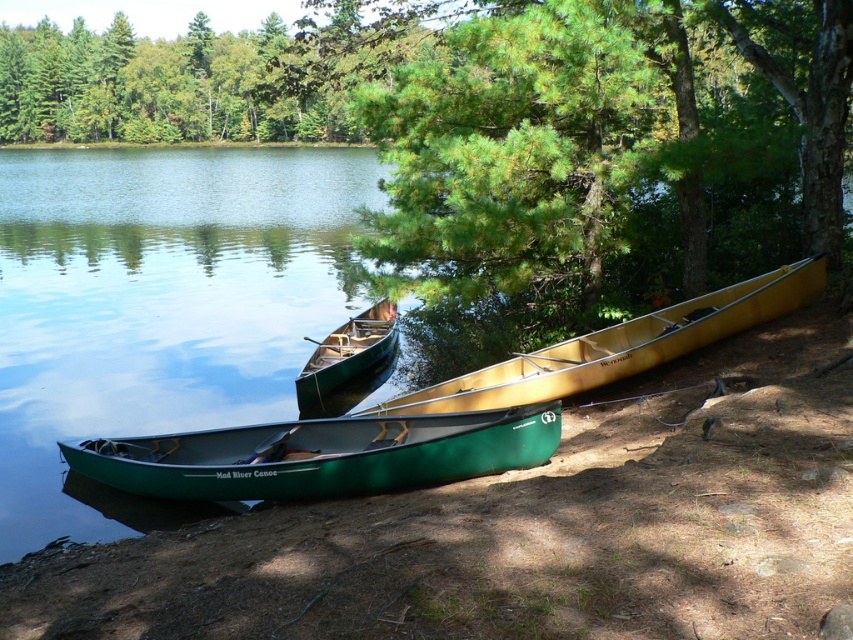
You are planning to take a photo of the matte yellow canoe at center. To avoid having the green pine tree at center in the background, should you move the camera to the left or right of the canoe?

Since the green pine tree at center is to the left of the matte yellow canoe at center, moving the camera to the right of the canoe would place the tree out of the frame, keeping it out of the background.

Looking at this image, you are standing at the point labeled point (155, 86) in the image. What do you see directly in front of you?

You see green leafy trees at upper center directly in front of you.

You are standing at the edge of the lake and want to take a photo of the green pine tree at center. Which direction should you face to ensure the tree is in the frame?

The green pine tree at center is located at point [579,129], so you should face towards the middle right direction to capture it in your photo.